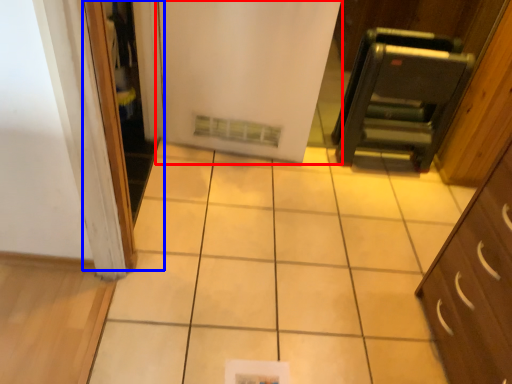
Question: Which point is closer to the camera, door (highlighted by a red box) or screen door (highlighted by a blue box)?

Choices:
 (A) door
 (B) screen door

Answer: (B)